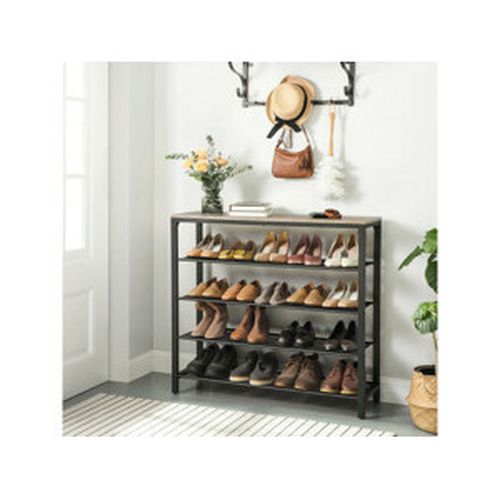
The height and width of the screenshot is (500, 500). I want to click on boots on shelf above bottom shelf, so click(x=257, y=334), click(x=240, y=332), click(x=217, y=330), click(x=198, y=330).